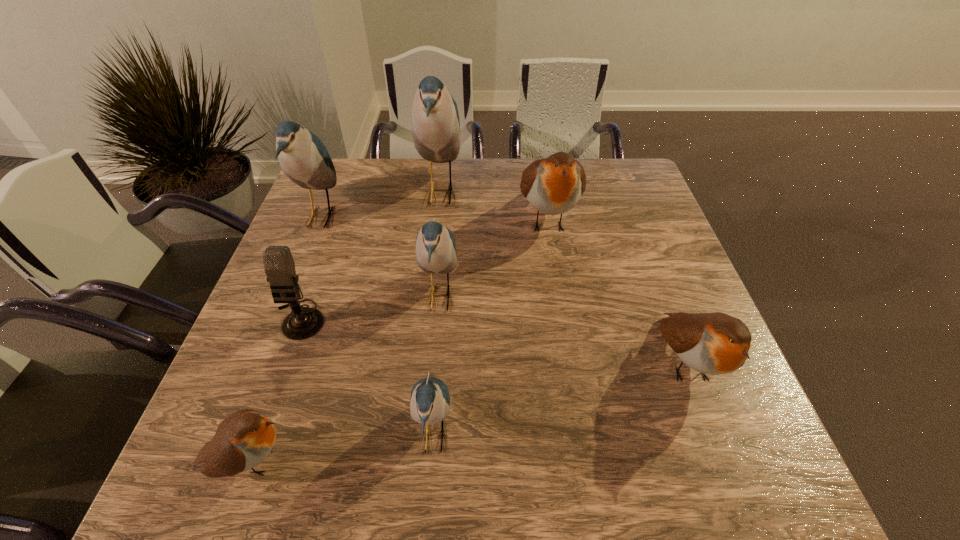
Where is `free space at the far right corner of the desktop`? This screenshot has width=960, height=540. free space at the far right corner of the desktop is located at coordinates click(598, 168).

The height and width of the screenshot is (540, 960). In order to click on free spot between the third farthest blue bird and the second tallest object in this screenshot , I will do `click(380, 257)`.

The image size is (960, 540). In order to click on vacant area that lies between the rightmost brown bird and the biggest brown bird in this screenshot , I will do pos(616,291).

Where is `free space between the second tallest object and the farthest brown bird`? This screenshot has height=540, width=960. free space between the second tallest object and the farthest brown bird is located at coordinates (434, 218).

Where is `free spot between the smallest blue bird and the second tallest object`? Image resolution: width=960 pixels, height=540 pixels. free spot between the smallest blue bird and the second tallest object is located at coordinates (377, 326).

At what (x,y) coordinates should I click in order to perform the action: click on free space between the second farthest brown bird and the tallest object. Please return your answer as a coordinate pair (x, y). Image resolution: width=960 pixels, height=540 pixels. Looking at the image, I should click on (564, 278).

Image resolution: width=960 pixels, height=540 pixels. Find the location of `blank region between the leftmost blue bird and the nearest blue bird`. blank region between the leftmost blue bird and the nearest blue bird is located at coordinates (377, 326).

The width and height of the screenshot is (960, 540). Identify the location of free space between the third biggest blue bird and the microphone. (370, 308).

Locate an element on the screen. This screenshot has height=540, width=960. free space that is in between the shortest object and the rightmost bird is located at coordinates (468, 411).

I want to click on free space that is in between the biggest blue bird and the second biggest blue bird, so click(380, 205).